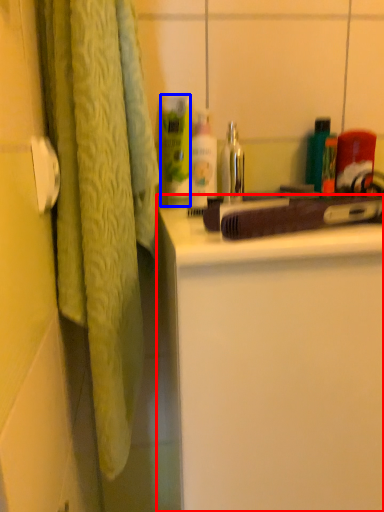
Question: Which of the following is the closest to the observer, bathroom cabinet (highlighted by a red box) or cleaning product (highlighted by a blue box)?

Choices:
 (A) bathroom cabinet
 (B) cleaning product

Answer: (A)